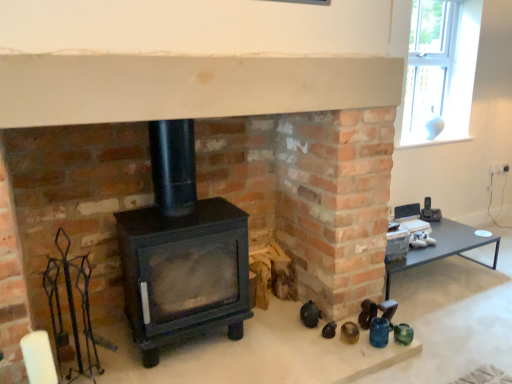
This screenshot has height=384, width=512. What do you see at coordinates (443, 248) in the screenshot? I see `matte black table at right` at bounding box center [443, 248].

The image size is (512, 384). Describe the element at coordinates (440, 70) in the screenshot. I see `white glass vase at upper right` at that location.

This screenshot has height=384, width=512. What are the coordinates of `matte black table at right` in the screenshot? It's located at tap(443, 248).

Between matte black table at right and white glass vase at upper right, which one has more height?

Standing taller between the two is white glass vase at upper right.

Is matte black table at right oriented away from white glass vase at upper right?

matte black table at right is not turned away from white glass vase at upper right.

Is matte black table at right bigger or smaller than black matte wood burning stove at center?

Considering their sizes, matte black table at right takes up less space than black matte wood burning stove at center.

How different are the orientations of matte black table at right and black matte wood burning stove at center in degrees?

The angle between the facing direction of matte black table at right and the facing direction of black matte wood burning stove at center is 0.0887 degrees.

Is matte black table at right facing towards black matte wood burning stove at center?

No, matte black table at right does not turn towards black matte wood burning stove at center.

From the image's perspective, which is below, matte black table at right or black matte wood burning stove at center?

matte black table at right is shown below in the image.

Considering the sizes of objects white glass vase at upper right and matte black table at right in the image provided, who is thinner, white glass vase at upper right or matte black table at right?

white glass vase at upper right is thinner.

Is white glass vase at upper right facing towards matte black table at right?

No, white glass vase at upper right is not oriented towards matte black table at right.

Does white glass vase at upper right lie in front of matte black table at right?

No, white glass vase at upper right is further to the viewer.

From a real-world perspective, between white glass vase at upper right and matte black table at right, who is vertically higher?

In real-world perspective, white glass vase at upper right is above.

How distant is black matte wood burning stove at center from matte black table at right?

1.29 meters.

Is black matte wood burning stove at center touching matte black table at right?

No.

Is black matte wood burning stove at center inside the boundaries of matte black table at right, or outside?

The correct answer is: outside.

Who is more distant, black matte wood burning stove at center or white glass vase at upper right?

white glass vase at upper right.

Does black matte wood burning stove at center turn towards white glass vase at upper right?

No, black matte wood burning stove at center is not turned towards white glass vase at upper right.

Between black matte wood burning stove at center and white glass vase at upper right, which one has larger width?

black matte wood burning stove at center.

From a real-world perspective, which object rests below the other?

black matte wood burning stove at center is physically lower.

In the image, is white glass vase at upper right on the left side or the right side of black matte wood burning stove at center?

From the image, it's evident that white glass vase at upper right is to the right of black matte wood burning stove at center.

Would you say white glass vase at upper right is inside or outside black matte wood burning stove at center?

white glass vase at upper right lies outside black matte wood burning stove at center.

Can you confirm if white glass vase at upper right is taller than black matte wood burning stove at center?

Yes.

Between point (469, 67) and point (239, 222), which one is positioned behind?

The point (469, 67) is behind.

Locate an element on the screen. This screenshot has width=512, height=384. table located underneath the white glass vase at upper right (from a real-world perspective) is located at coordinates (443, 248).

This screenshot has width=512, height=384. I want to click on table behind the black matte wood burning stove at center, so click(x=443, y=248).

Based on their spatial positions, is matte black table at right or white glass vase at upper right closer to black matte wood burning stove at center?

matte black table at right.

Considering their positions, is black matte wood burning stove at center positioned closer to matte black table at right than white glass vase at upper right?

Among the two, white glass vase at upper right is located nearer to matte black table at right.

From the image, which object appears to be nearer to white glass vase at upper right, black matte wood burning stove at center or matte black table at right?

matte black table at right lies closer to white glass vase at upper right than the other object.

Estimate the real-world distances between objects in this image. Which object is closer to black matte wood burning stove at center, white glass vase at upper right or matte black table at right?

Among the two, matte black table at right is located nearer to black matte wood burning stove at center.

When comparing their distances from matte black table at right, does white glass vase at upper right or black matte wood burning stove at center seem further?

black matte wood burning stove at center is further to matte black table at right.

When comparing their distances from white glass vase at upper right, does matte black table at right or black matte wood burning stove at center seem further?

black matte wood burning stove at center is positioned further to the anchor white glass vase at upper right.

Find the location of `table between black matte wood burning stove at center and white glass vase at upper right in the horizontal direction`. table between black matte wood burning stove at center and white glass vase at upper right in the horizontal direction is located at coordinates (443, 248).